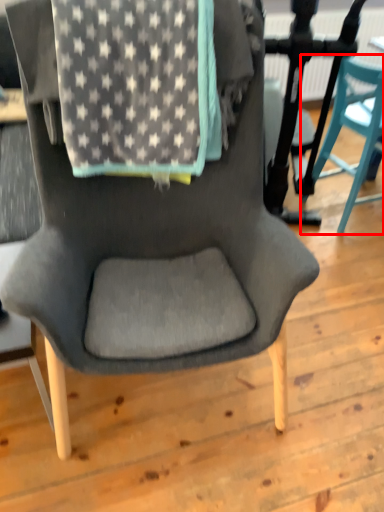
Question: From the image's perspective, considering the relative positions of chair (annotated by the red box) and blanket in the image provided, where is chair (annotated by the red box) located with respect to the staircase?

Choices:
 (A) above
 (B) below

Answer: (A)